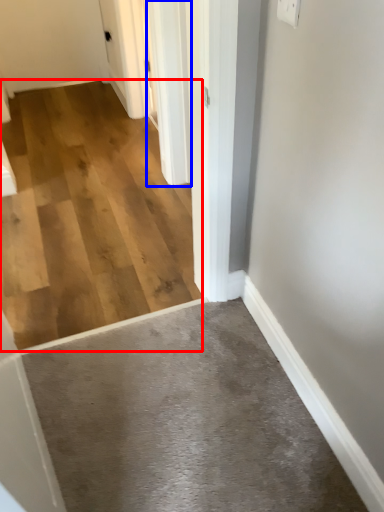
Question: Which object appears farthest to the camera in this image, concrete (highlighted by a red box) or door (highlighted by a blue box)?

Choices:
 (A) concrete
 (B) door

Answer: (B)